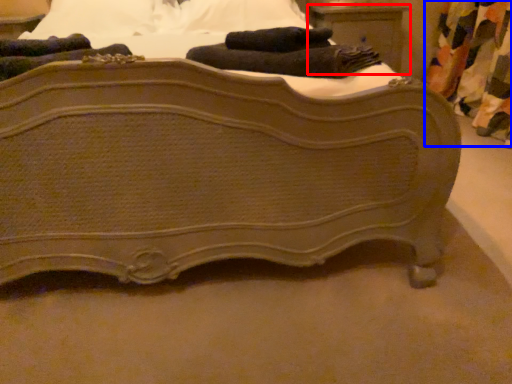
Question: Which object appears closest to the camera in this image, nightstand (highlighted by a red box) or curtain (highlighted by a blue box)?

Choices:
 (A) nightstand
 (B) curtain

Answer: (B)